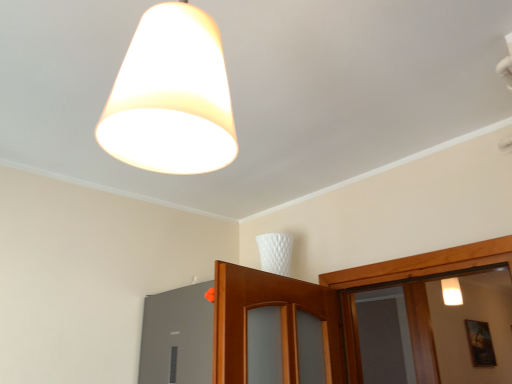
Question: Could you tell me if matte gray window at lower left is facing white matte lampshade at upper center?

Choices:
 (A) yes
 (B) no

Answer: (B)

Question: Can you confirm if matte gray window at lower left is bigger than white matte lampshade at upper center?

Choices:
 (A) yes
 (B) no

Answer: (B)

Question: Is the position of matte gray window at lower left more distant than that of white matte lampshade at upper center?

Choices:
 (A) yes
 (B) no

Answer: (A)

Question: Is matte gray window at lower left oriented away from white matte lampshade at upper center?

Choices:
 (A) yes
 (B) no

Answer: (B)

Question: Considering the relative positions of matte gray window at lower left and white matte lampshade at upper center in the image provided, is matte gray window at lower left to the left of white matte lampshade at upper center from the viewer's perspective?

Choices:
 (A) yes
 (B) no

Answer: (A)

Question: Can you confirm if matte gray window at lower left is thinner than white matte lampshade at upper center?

Choices:
 (A) no
 (B) yes

Answer: (B)

Question: Does white matte lampshade at upper center touch matte gray window at lower left?

Choices:
 (A) no
 (B) yes

Answer: (A)

Question: From the image's perspective, is white matte lampshade at upper center located above matte gray window at lower left?

Choices:
 (A) yes
 (B) no

Answer: (A)

Question: Considering the relative sizes of white matte lampshade at upper center and matte gray window at lower left in the image provided, is white matte lampshade at upper center thinner than matte gray window at lower left?

Choices:
 (A) no
 (B) yes

Answer: (A)

Question: Does white matte lampshade at upper center lie behind matte gray window at lower left?

Choices:
 (A) no
 (B) yes

Answer: (A)

Question: From the image's perspective, is white matte lampshade at upper center under matte gray window at lower left?

Choices:
 (A) yes
 (B) no

Answer: (B)

Question: From a real-world perspective, is white matte lampshade at upper center over matte gray window at lower left?

Choices:
 (A) yes
 (B) no

Answer: (A)

Question: Is wooden framed picture at lower right beside white matte lampshade at upper center?

Choices:
 (A) no
 (B) yes

Answer: (A)